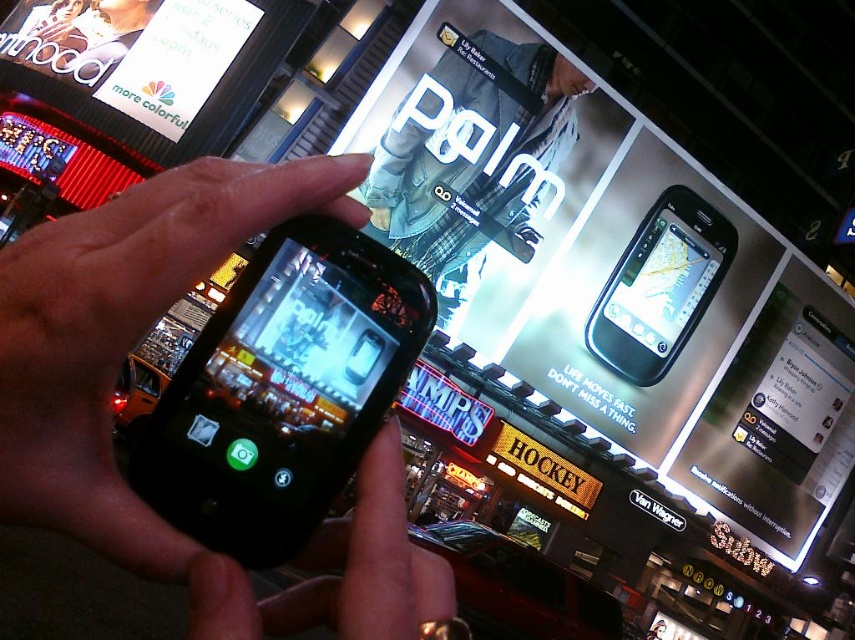
You are a photographer trying to capture the billboard advertisement for Palm. You notice a black matte phone at center at point (111, 385). Is the phone in the frame of the billboard advertisement?

The black matte phone at center at point (111, 385) is located at the center of the image, while the billboard is positioned in the background. Since the phone is held by the person in the foreground, it is blocking part of the billboard and thus is not within the frame of the billboard advertisement itself.

You are a photographer trying to capture the billboard and the hockey store sign in your shot. You notice two points in the scene at coordinates point (773, 422) and point (650, 241). Which point is closer to your camera lens?

Point (650, 241) is closer to the camera lens because the Objects Description states that point (773, 422) is further to the camera than point (650, 241).